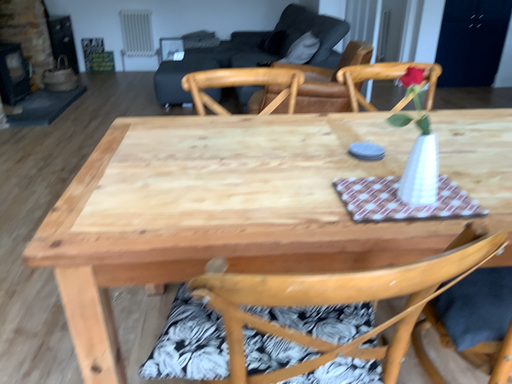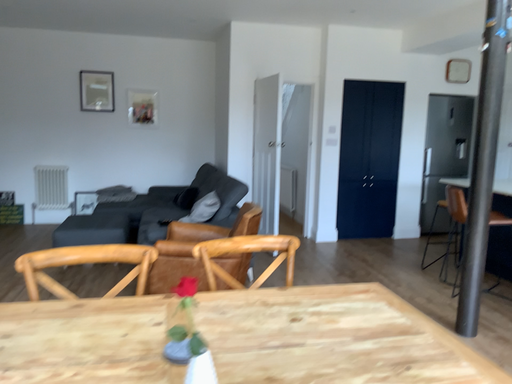
Question: Which way did the camera rotate in the video?

Choices:
 (A) rotated downward
 (B) rotated upward

Answer: (B)